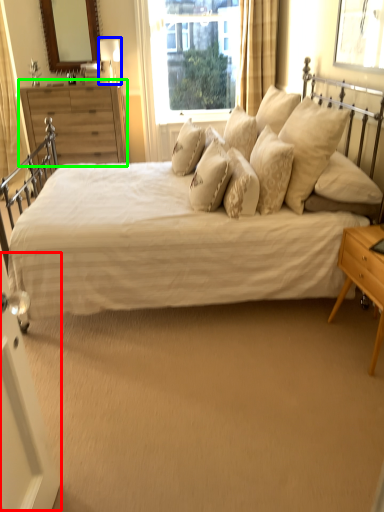
Question: Estimate the real-world distances between objects in this image. Which object is closer to screen door (highlighted by a red box), table lamp (highlighted by a blue box) or chest of drawers (highlighted by a green box)?

Choices:
 (A) table lamp
 (B) chest of drawers

Answer: (B)